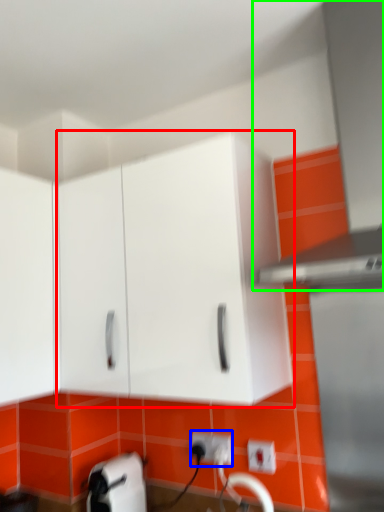
Question: Considering the real-world distances, which object is farthest from cabinetry (highlighted by a red box)? electric outlet (highlighted by a blue box) or exhaust hood (highlighted by a green box)?

Choices:
 (A) electric outlet
 (B) exhaust hood

Answer: (A)